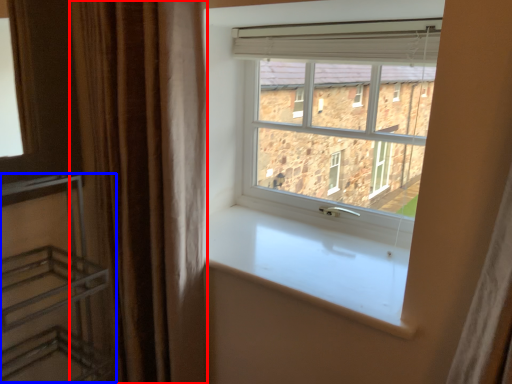
Question: Which object appears closest to the camera in this image, curtain (highlighted by a red box) or shelf (highlighted by a blue box)?

Choices:
 (A) curtain
 (B) shelf

Answer: (B)